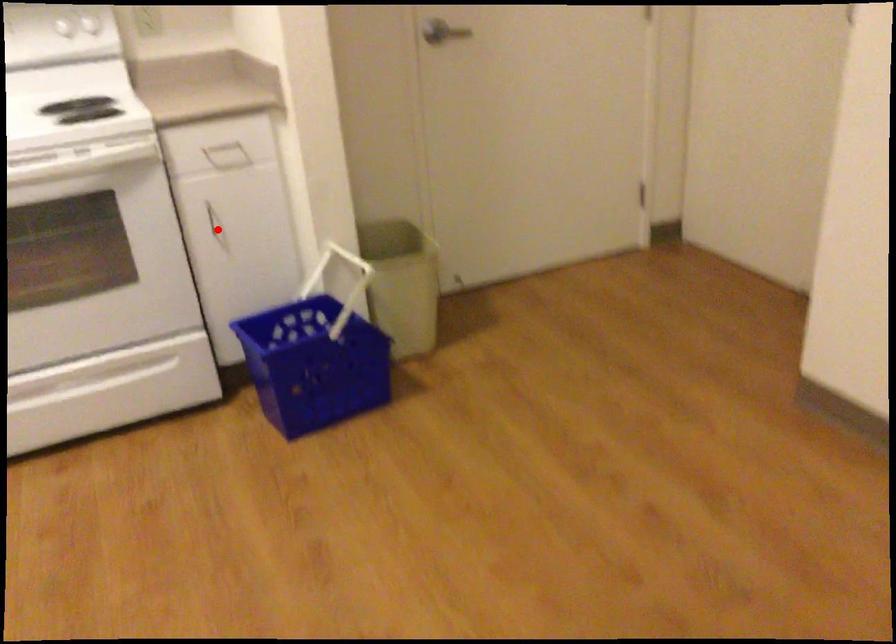
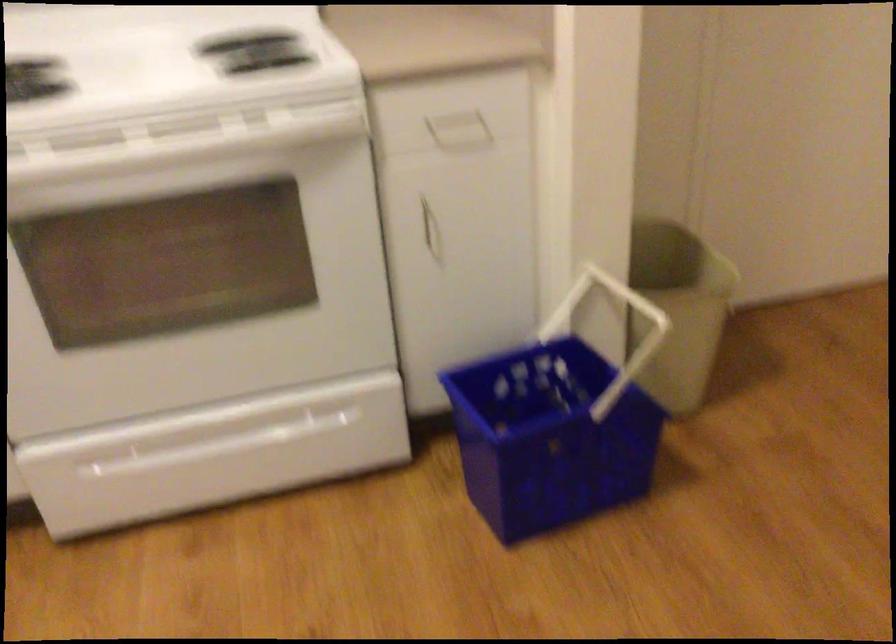
In the second image, find the point that corresponds to the highlighted location in the first image.

(431, 234)